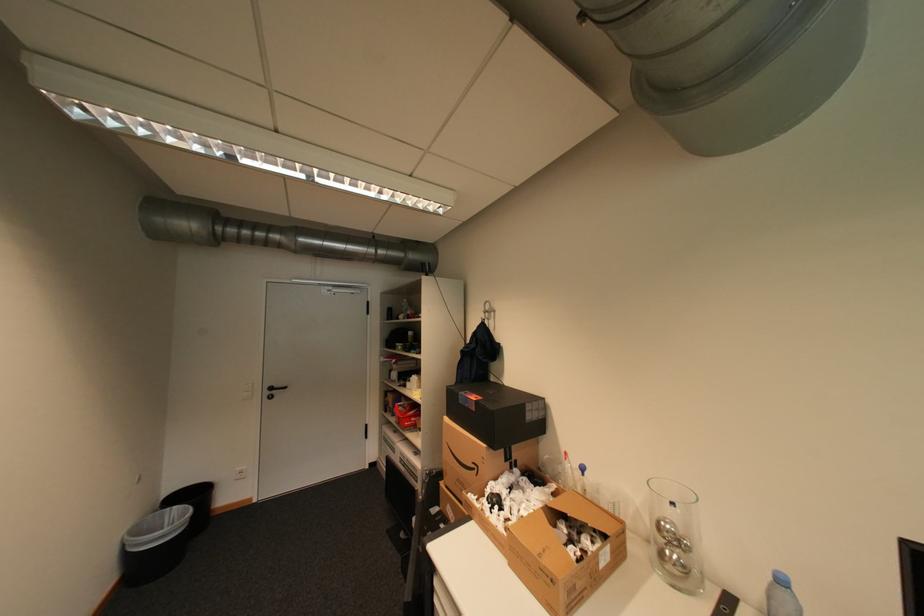
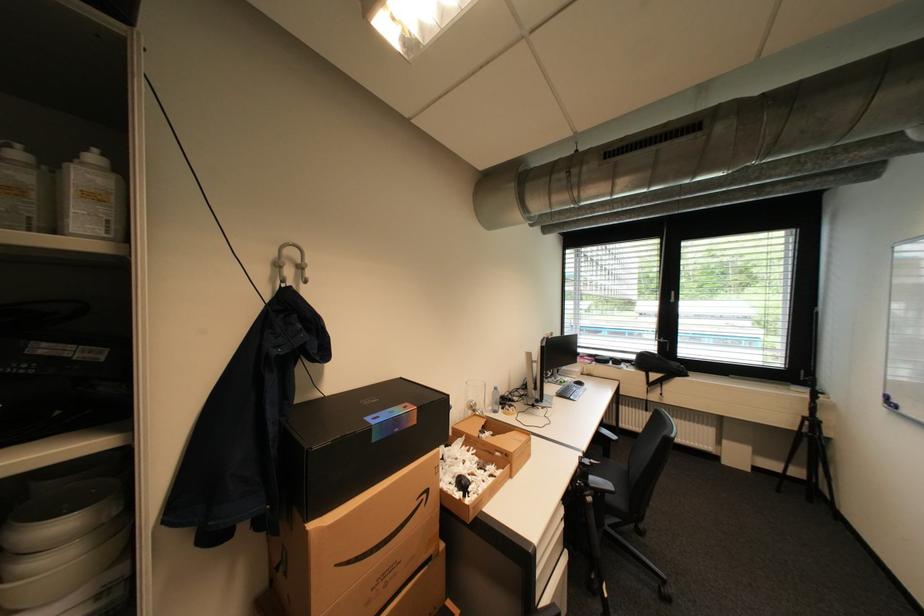
In the second image, find the point that corresponds to (x=476, y=406) in the first image.

(405, 431)